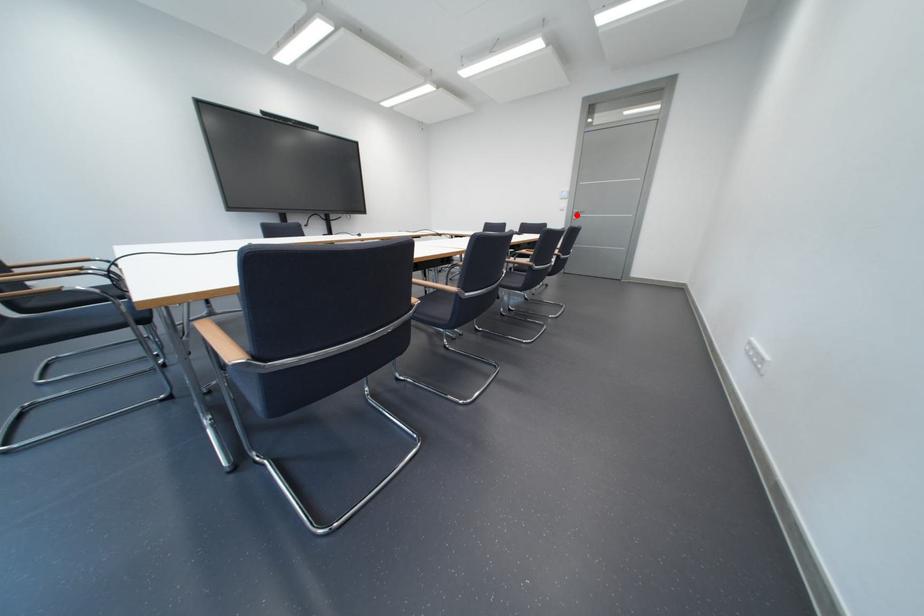
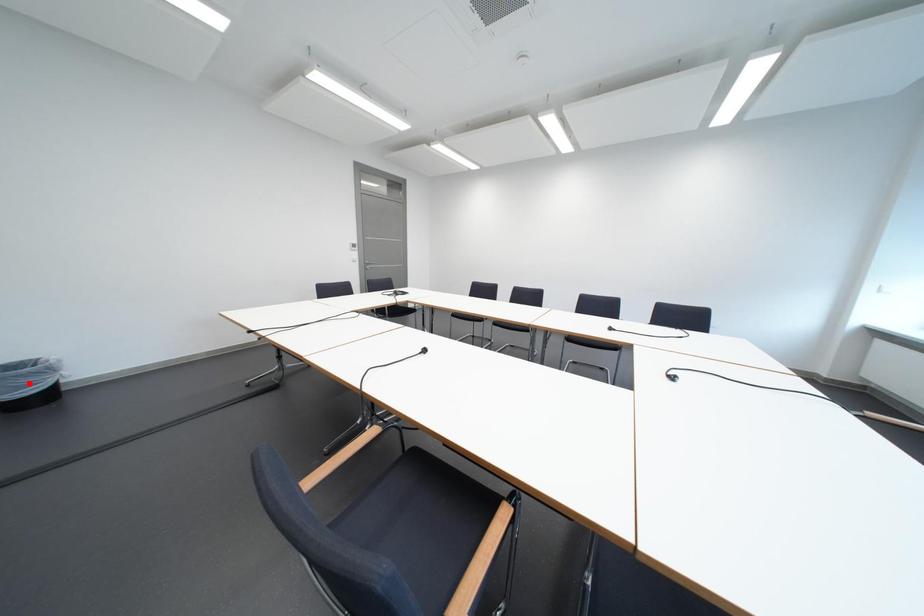
In the scene shown: I am providing you with two images of the same scene from different viewpoints. A red point is marked on the first image and another point is marked on the second image. Is the red point in image1 aligned with the point shown in image2?

No